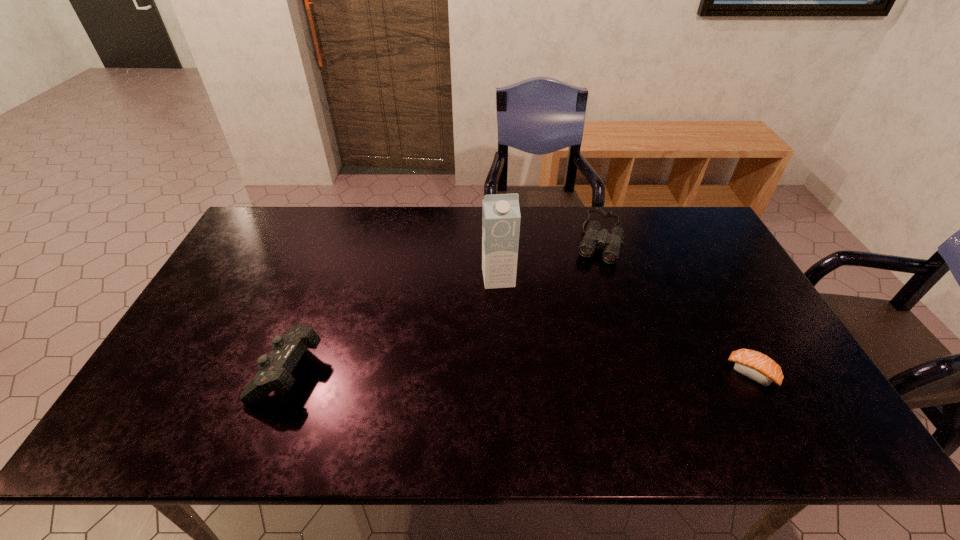
Where is `free spot on the desktop that is between the leftmost object and the rightmost object and is positioned on the front label of the tallest object`? free spot on the desktop that is between the leftmost object and the rightmost object and is positioned on the front label of the tallest object is located at coordinates (516, 371).

At what (x,y) coordinates should I click in order to perform the action: click on vacant space on the desktop that is between the third shortest object and the rightmost object and is positioned at the eyepiece of the farthest object. Please return your answer as a coordinate pair (x, y). Looking at the image, I should click on (553, 372).